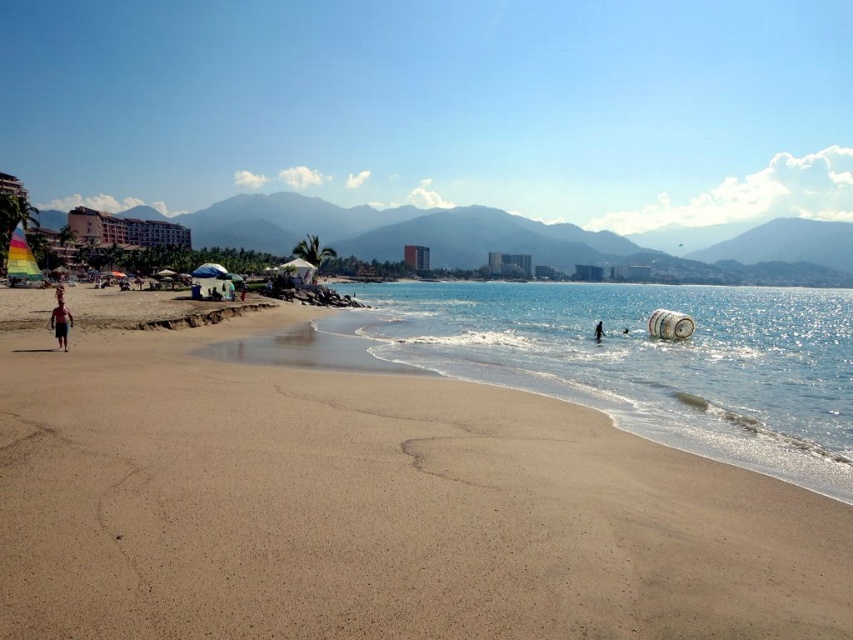
You are standing at the edge of the beach and want to walk towards the smooth sand at lower center and the smooth skin person at lower right. Which object will you reach first?

You will reach the smooth sand at lower center first because it is closer to you than the smooth skin person at lower right.

You are standing on the beach and want to reach the clear blue water at center and the tan skin person at left. Which one is closer to you?

The clear blue water at center is closer to you than the tan skin person at left.

You are standing on the beach and see both the tan skin person at left and the smooth skin person at lower right. Which person is nearer to you?

The tan skin person at left is closer to the viewer than the smooth skin person at lower right.